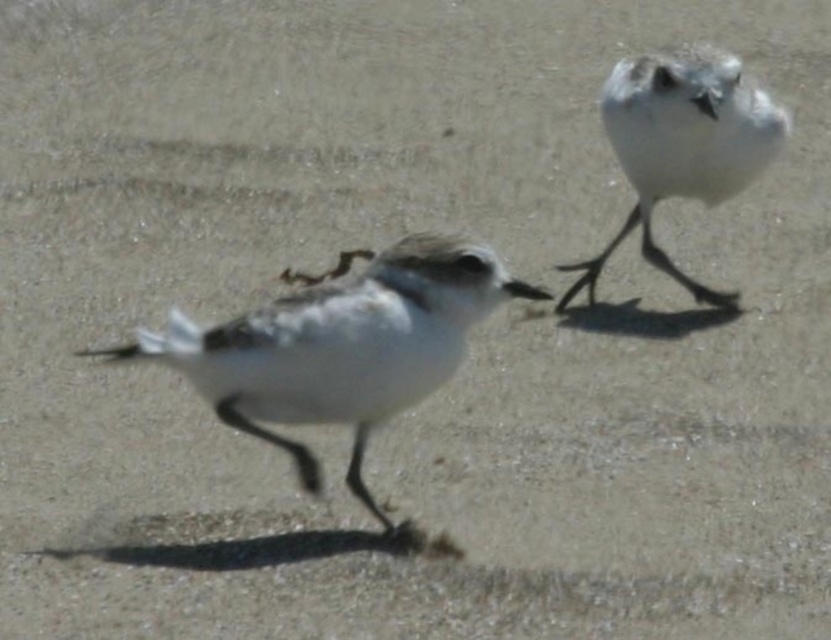
You are a photographer trying to capture a closeup of the bird at point (482, 256) and the bird at point (657, 259). Which bird should you focus on first to ensure it appears sharp in your photo?

You should focus on the bird at point (482, 256) first because it is closer to the camera than the bird at point (657, 259), ensuring it will be in focus.